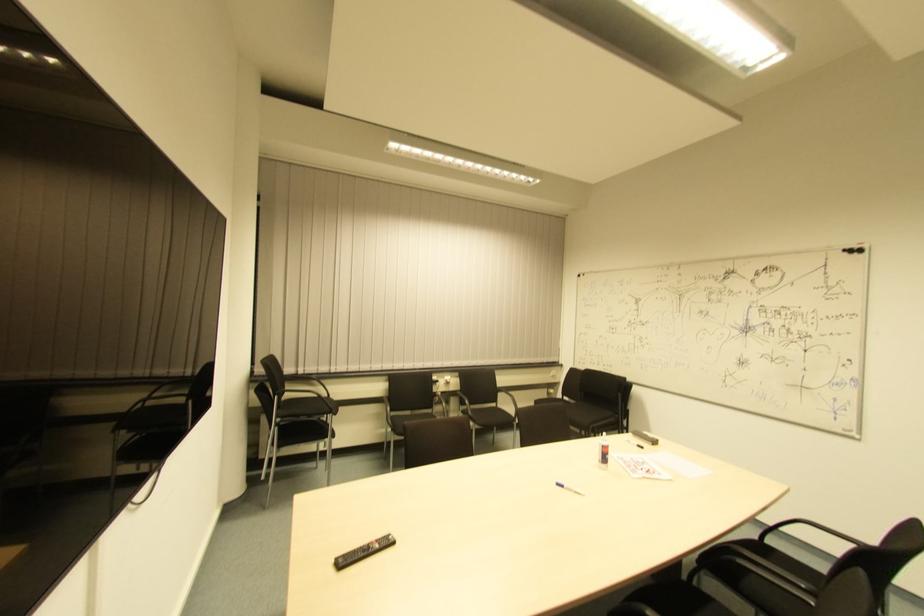
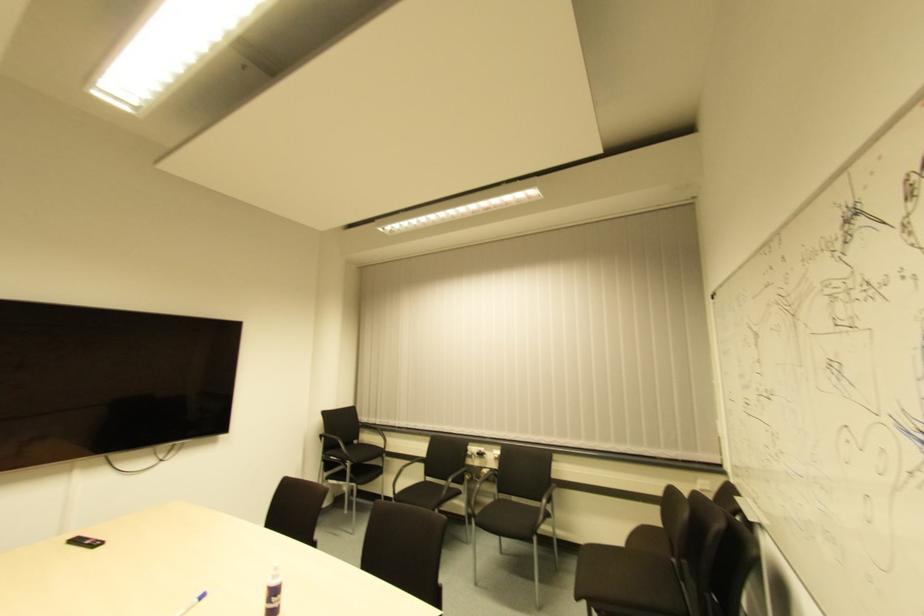
Find the pixel in the second image that matches the point at 341,565 in the first image.

(73, 543)